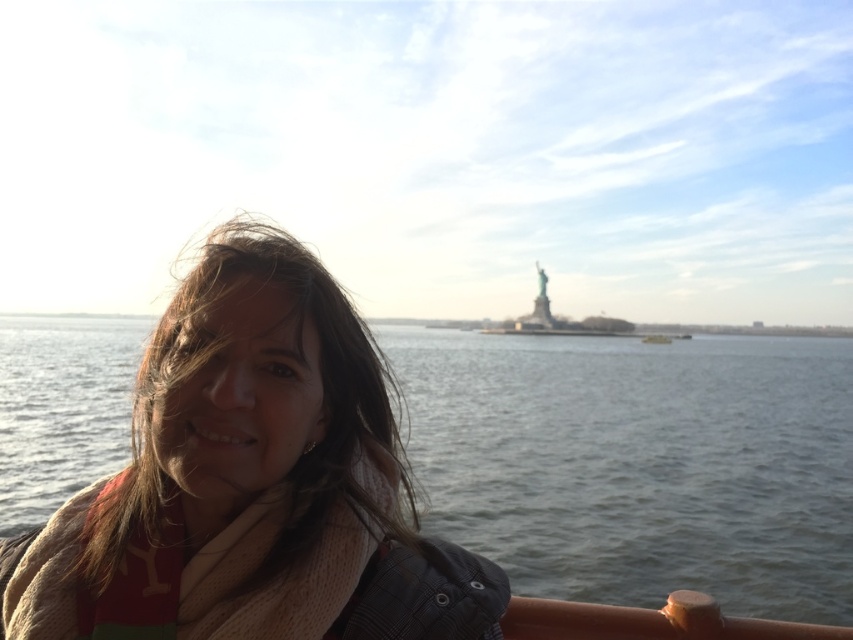
Question: Can you confirm if clear water at lower left is wider than knitted beige scarf at center?

Choices:
 (A) no
 (B) yes

Answer: (B)

Question: Among these objects, which one is nearest to the camera?

Choices:
 (A) clear water at lower left
 (B) knitted beige scarf at center

Answer: (B)

Question: Is clear water at lower left below knitted beige scarf at center?

Choices:
 (A) no
 (B) yes

Answer: (A)

Question: Is clear water at lower left below knitted beige scarf at center?

Choices:
 (A) yes
 (B) no

Answer: (B)

Question: Which point appears farthest from the camera in this image?

Choices:
 (A) (283, 544)
 (B) (482, 524)

Answer: (B)